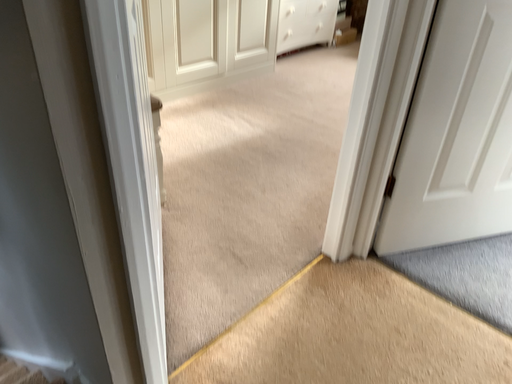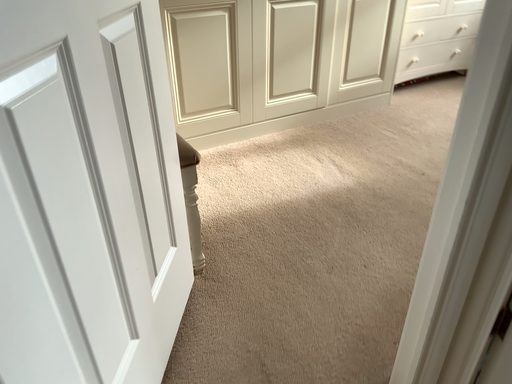
Question: Which way did the camera rotate in the video?

Choices:
 (A) rotated right
 (B) rotated left

Answer: (B)